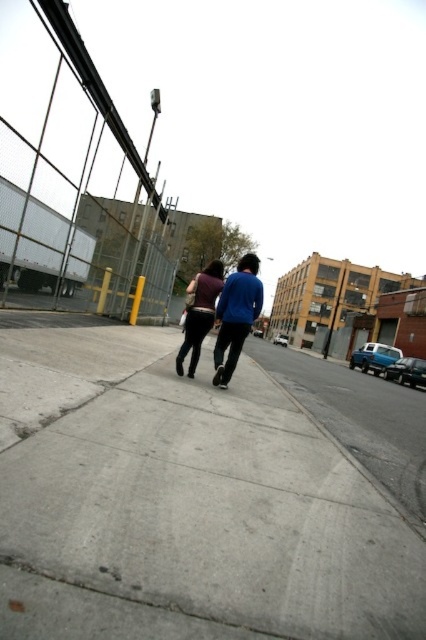
Question: Is the position of matte blue jacket at center more distant than that of matte purple shirt at center?

Choices:
 (A) no
 (B) yes

Answer: (A)

Question: Is gray concrete sidewalk at center to the right of matte blue jacket at center from the viewer's perspective?

Choices:
 (A) yes
 (B) no

Answer: (B)

Question: Which of the following is the closest to the observer?

Choices:
 (A) matte purple shirt at center
 (B) matte blue jacket at center

Answer: (B)

Question: Among these points, which one is nearest to the camera?

Choices:
 (A) (287, 579)
 (B) (241, 289)
 (C) (195, 289)

Answer: (A)

Question: Can you confirm if gray concrete sidewalk at center is bigger than matte purple shirt at center?

Choices:
 (A) no
 (B) yes

Answer: (B)

Question: Which of the following is the closest to the observer?

Choices:
 (A) matte purple shirt at center
 (B) matte blue jacket at center
 (C) gray concrete sidewalk at center

Answer: (C)